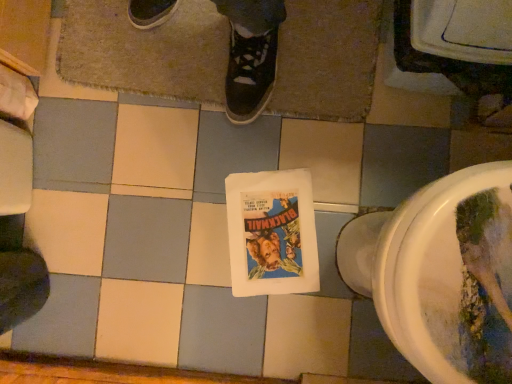
Locate an element on the screen. The height and width of the screenshot is (384, 512). vacant space in between white glossy toilet at lower right and matte paper comic book at center is located at coordinates (307, 237).